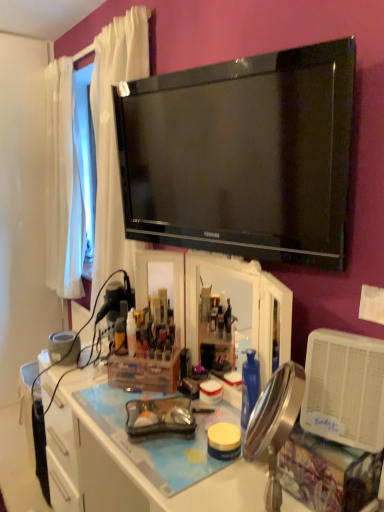
Question: From a real-world perspective, is translucent plastic bottle at center, the first bottle when ordered from left to right, physically above translucent plastic container at center?

Choices:
 (A) no
 (B) yes

Answer: (B)

Question: Is translucent plastic bottle at center, which is the 2th bottle in right-to-left order, bigger than translucent plastic container at center?

Choices:
 (A) no
 (B) yes

Answer: (A)

Question: Is translucent plastic bottle at center, the first bottle when ordered from left to right, completely or partially outside of translucent plastic container at center?

Choices:
 (A) yes
 (B) no

Answer: (A)

Question: Considering the relative sizes of translucent plastic bottle at center, the first bottle when ordered from left to right, and translucent plastic container at center in the image provided, is translucent plastic bottle at center, the first bottle when ordered from left to right, wider than translucent plastic container at center?

Choices:
 (A) yes
 (B) no

Answer: (B)

Question: Is translucent plastic bottle at center, the first bottle when ordered from left to right, taller than translucent plastic container at center?

Choices:
 (A) yes
 (B) no

Answer: (B)

Question: Considering their positions, is translucent plastic bottle at center, the 1th bottle when ordered from right to left, located in front of or behind clear plastic desk at center?

Choices:
 (A) front
 (B) behind

Answer: (B)

Question: Considering the positions of point tap(132, 309) and point tap(137, 451), is point tap(132, 309) closer or farther from the camera than point tap(137, 451)?

Choices:
 (A) farther
 (B) closer

Answer: (A)

Question: Is translucent plastic bottle at center, which is the second bottle in left-to-right order, inside the boundaries of clear plastic desk at center, or outside?

Choices:
 (A) outside
 (B) inside

Answer: (A)

Question: Looking at the image, does translucent plastic bottle at center, the 1th bottle when ordered from right to left, seem bigger or smaller compared to clear plastic desk at center?

Choices:
 (A) big
 (B) small

Answer: (B)

Question: Considering the relative positions of metallic gold mirror at center and translucent plastic bottle at center, which is the second bottle in left-to-right order, in the image provided, is metallic gold mirror at center to the left or to the right of translucent plastic bottle at center, which is the second bottle in left-to-right order,?

Choices:
 (A) left
 (B) right

Answer: (B)

Question: Looking at the image, does metallic gold mirror at center seem bigger or smaller compared to translucent plastic bottle at center, which is the second bottle in left-to-right order?

Choices:
 (A) small
 (B) big

Answer: (B)

Question: In terms of width, does metallic gold mirror at center look wider or thinner when compared to translucent plastic bottle at center, the 1th bottle when ordered from right to left?

Choices:
 (A) thin
 (B) wide

Answer: (B)

Question: Considering the positions of point (246, 431) and point (132, 308), is point (246, 431) closer or farther from the camera than point (132, 308)?

Choices:
 (A) closer
 (B) farther

Answer: (A)

Question: In terms of width, does clear plastic desk at center look wider or thinner when compared to black glossy tv at upper center?

Choices:
 (A) wide
 (B) thin

Answer: (A)

Question: Would you say clear plastic desk at center is inside or outside black glossy tv at upper center?

Choices:
 (A) inside
 (B) outside

Answer: (B)